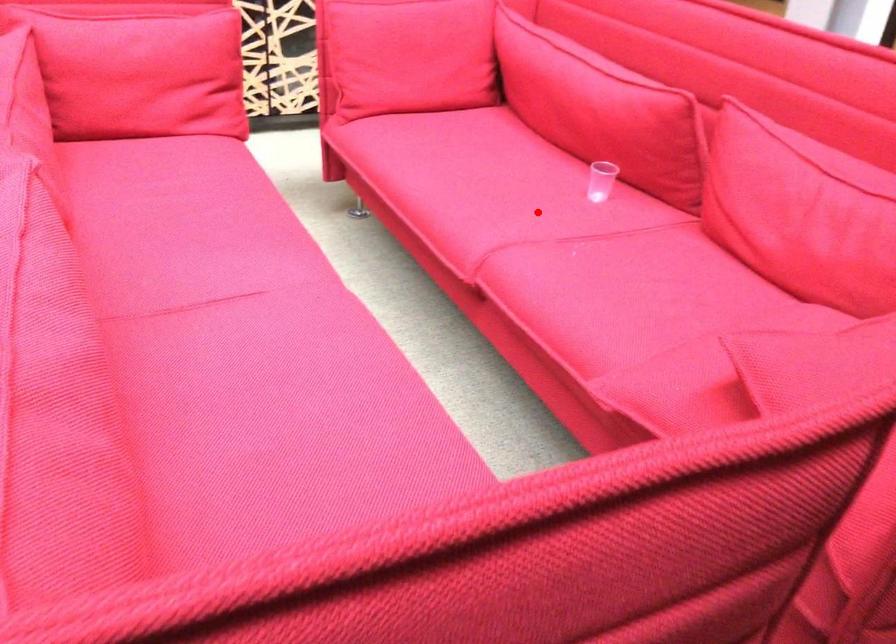
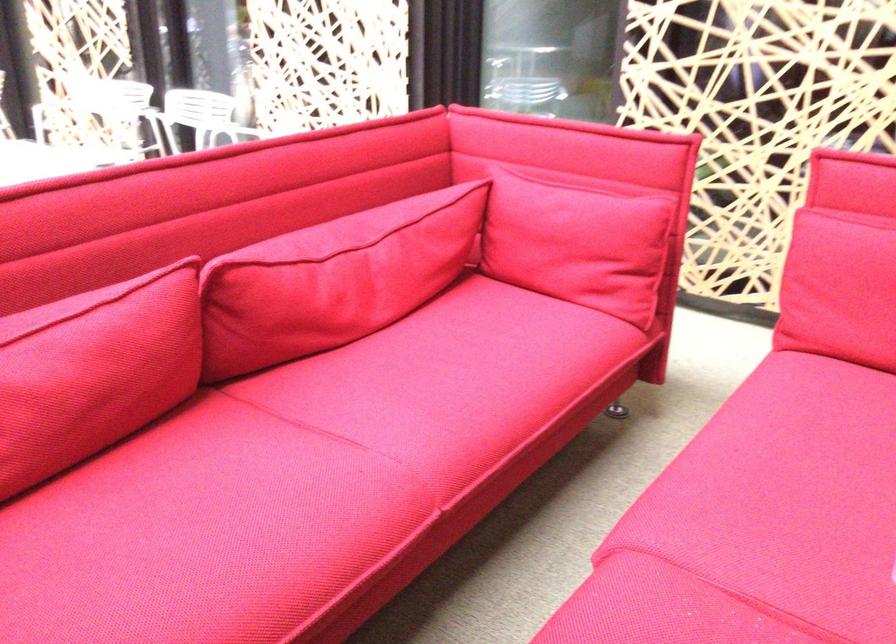
Where in the second image is the point corresponding to the highlighted location from the first image?

(759, 522)